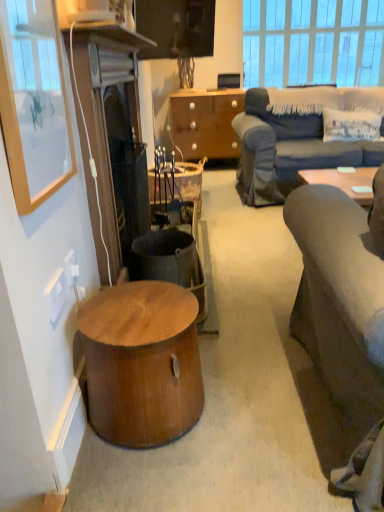
Question: From a real-world perspective, is dark brown wood fireplace at left above or below rustic wood trash bin/can at center?

Choices:
 (A) below
 (B) above

Answer: (B)

Question: Is dark brown wood fireplace at left inside or outside of rustic wood trash bin/can at center?

Choices:
 (A) outside
 (B) inside

Answer: (A)

Question: Considering the real-world distances, which object is closest to the rustic wood trash bin/can at center?

Choices:
 (A) dark brown wood fireplace at left
 (B) matte wooden picture frame at upper left
 (C) wooden chest of drawers at center
 (D) white plastic power outlet at lower left, placed as the 2th power outlet when sorted from front to back
 (E) rustic wood desk at center

Answer: (A)

Question: Considering the real-world distances, which object is farthest from the wooden chest of drawers at center?

Choices:
 (A) rustic wood desk at center
 (B) white plastic power outlet at lower left, placed as the 2th power outlet when sorted from front to back
 (C) matte black speaker at upper center
 (D) white plastic power outlet at lower left, the second power outlet positioned from the back
 (E) wooden round stool at lower left

Answer: (D)